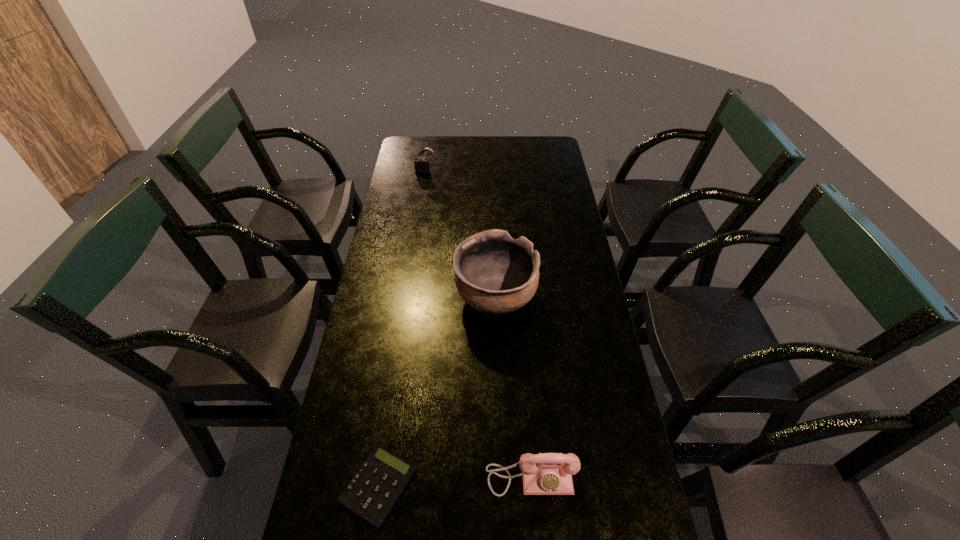
Identify the location of vacant area that lies between the pottery and the telephone. (513, 387).

Locate an element on the screen. vacant point located between the telephone and the farthest object is located at coordinates (478, 324).

Image resolution: width=960 pixels, height=540 pixels. What are the coordinates of `vacant area that lies between the telephone and the third nearest object` in the screenshot? It's located at (513, 387).

Locate an element on the screen. vacant space that is in between the farthest object and the telephone is located at coordinates (478, 324).

This screenshot has height=540, width=960. I want to click on vacant area between the telephone and the farthest object, so click(x=478, y=324).

Locate an element on the screen. The image size is (960, 540). free area in between the farthest object and the calculator is located at coordinates (402, 329).

Locate an element on the screen. The height and width of the screenshot is (540, 960). object that stands as the third closest to the telephone is located at coordinates (421, 165).

Find the location of `object that is the nearest to the farthest object`. object that is the nearest to the farthest object is located at coordinates (495, 274).

Locate an element on the screen. free location that satisfies the following two spatial constraints: 1. with the keyhole on the front of the padlock; 2. on the right side of the pottery is located at coordinates (406, 298).

The width and height of the screenshot is (960, 540). Identify the location of vacant position in the image that satisfies the following two spatial constraints: 1. with the keyhole on the front of the tallest object; 2. on the left side of the padlock. coord(406,298).